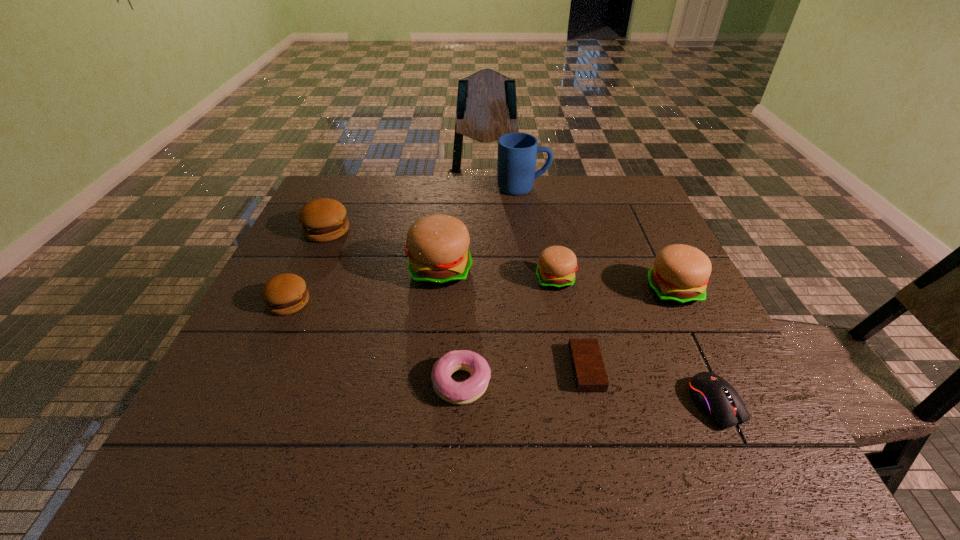
You are a GUI agent. You are given a task and a screenshot of the screen. Output one action in this format:
    pyautogui.click(x=<x>, y=<y>)
    Task: Click on the blue mug
    The height and width of the screenshot is (540, 960).
    Given the screenshot: What is the action you would take?
    pyautogui.click(x=517, y=152)

Image resolution: width=960 pixels, height=540 pixels. I want to click on mug, so click(517, 152).

Find the location of a particular element. This screenshot has height=540, width=960. the third hamburger from left to right is located at coordinates (437, 245).

At what (x,y) coordinates should I click in order to perform the action: click on the biggest beige hamburger. Please return your answer as a coordinate pair (x, y). The image size is (960, 540). Looking at the image, I should click on (437, 245).

This screenshot has width=960, height=540. I want to click on the rightmost hamburger, so click(x=680, y=274).

This screenshot has width=960, height=540. I want to click on the second smallest beige hamburger, so click(x=680, y=274).

Locate an element on the screen. The image size is (960, 540). the eighth nearest object is located at coordinates pos(324,219).

Find the location of `the bigger brown hamburger`. the bigger brown hamburger is located at coordinates (324, 219).

I want to click on the smallest beige hamburger, so click(557, 265).

Find the location of a particular element. The width and height of the screenshot is (960, 540). the second beige hamburger from right to left is located at coordinates (557, 265).